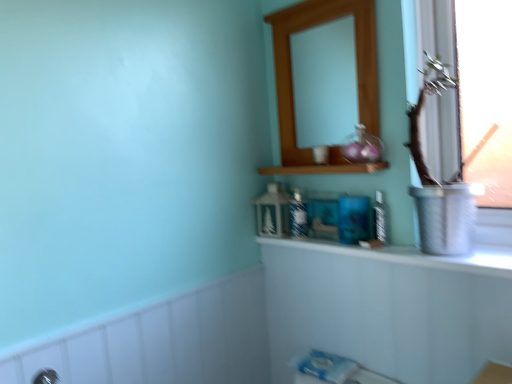
What are the coordinates of `space that is in front of clear plastic bottle at center, which is counted as the second toiletry, starting from the left` in the screenshot? It's located at (413, 251).